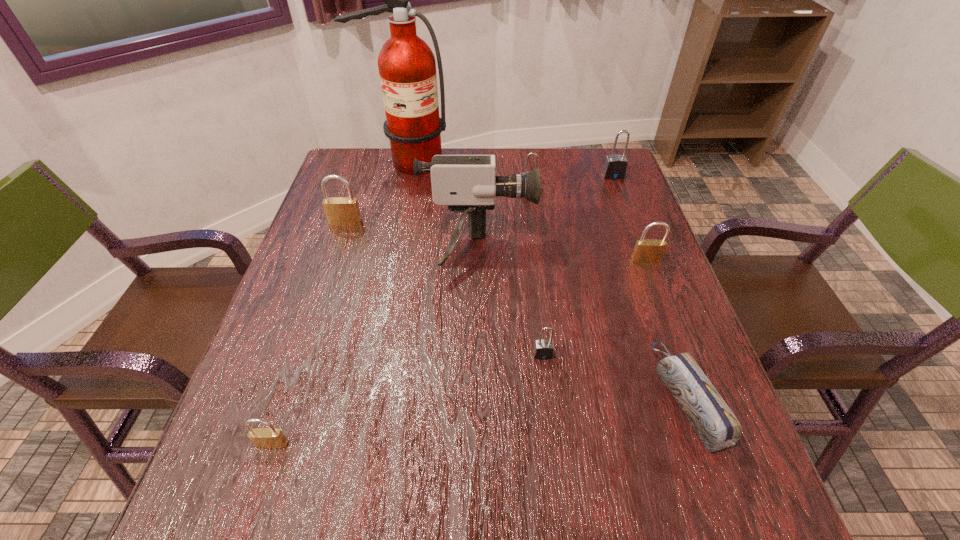
Locate an element on the screen. Image resolution: width=960 pixels, height=540 pixels. vacant area between the eighth shortest object and the second nearest padlock is located at coordinates (511, 303).

Where is `free point between the nearest padlock and the shortest object`? free point between the nearest padlock and the shortest object is located at coordinates (480, 421).

The width and height of the screenshot is (960, 540). In order to click on free space between the camcorder and the nearest gray padlock in this screenshot , I will do `click(511, 303)`.

The height and width of the screenshot is (540, 960). What are the coordinates of `vacant area that lies between the second smallest brass padlock and the nearest padlock` in the screenshot? It's located at (459, 352).

Image resolution: width=960 pixels, height=540 pixels. In order to click on blank region between the seventh nearest object and the second farthest brass padlock in this screenshot , I will do `click(588, 225)`.

You are a GUI agent. You are given a task and a screenshot of the screen. Output one action in this format:
    pyautogui.click(x=<x>, y=<y>)
    Task: Click on the blank region between the eighth shortest object and the pencil box
    The width and height of the screenshot is (960, 540).
    Given the screenshot: What is the action you would take?
    pyautogui.click(x=583, y=325)

Identify which object is the seventh closest to the rightmost brass padlock. Please provide its 2D coordinates. Your answer should be formatted as a tuple, i.e. [(x, y)], where the tuple contains the x and y coordinates of a point satisfying the conditions above.

[(340, 211)]

Where is `object that is the fourth closest one to the pencil box`? The height and width of the screenshot is (540, 960). object that is the fourth closest one to the pencil box is located at coordinates (529, 154).

Where is `the second closest padlock relative to the smallest brass padlock`? The height and width of the screenshot is (540, 960). the second closest padlock relative to the smallest brass padlock is located at coordinates (340, 211).

Choose which padlock is the sixth nearest neighbor to the fire extinguisher. Please provide its 2D coordinates. Your answer should be formatted as a tuple, i.e. [(x, y)], where the tuple contains the x and y coordinates of a point satisfying the conditions above.

[(267, 438)]